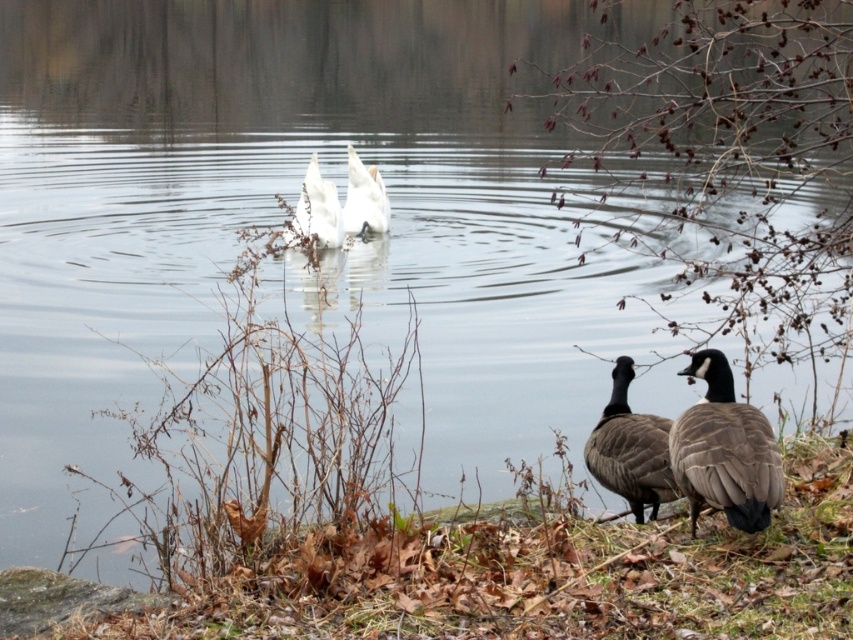
You are a photographer trying to capture a closeup shot of the brown feathered duck at lower right and the white matte goose at center. Which bird should you zoom in on first if you want to focus on the taller subject?

The white matte goose at center is taller than the brown feathered duck at lower right, so you should zoom in on the white matte goose at center first.

You are a wildlife photographer trying to capture a photo of both the gray feathered duck at lower right and the brown feathered duck at lower right. Since you want to ensure both are fully visible in the frame, which duck should you position closer to the camera to avoid cropping?

The gray feathered duck at lower right is smaller in width than the brown feathered duck at lower right. To ensure both are fully visible, position the gray feathered duck at lower right closer to the camera so its apparent size matches the brown feathered duck at lower right, preventing either from being cropped.